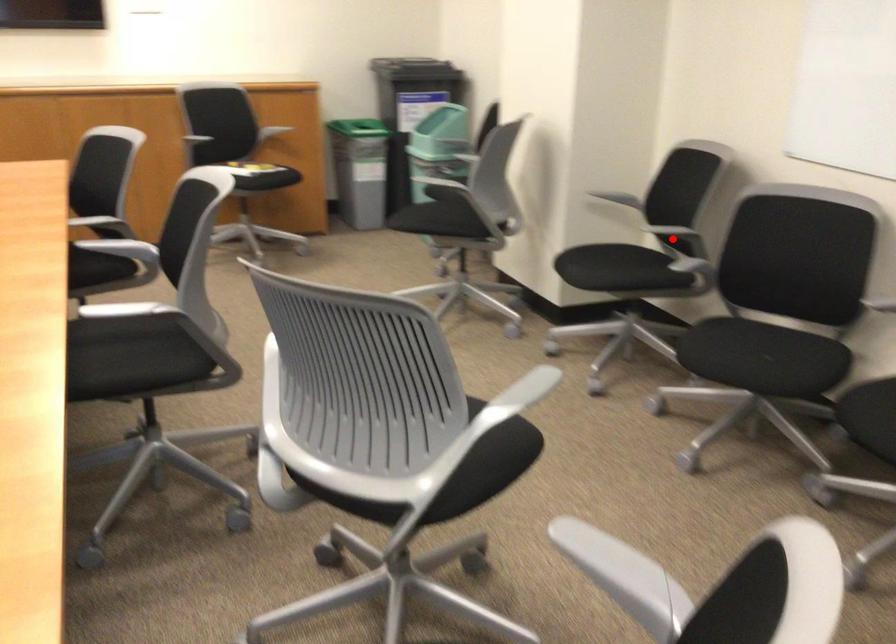
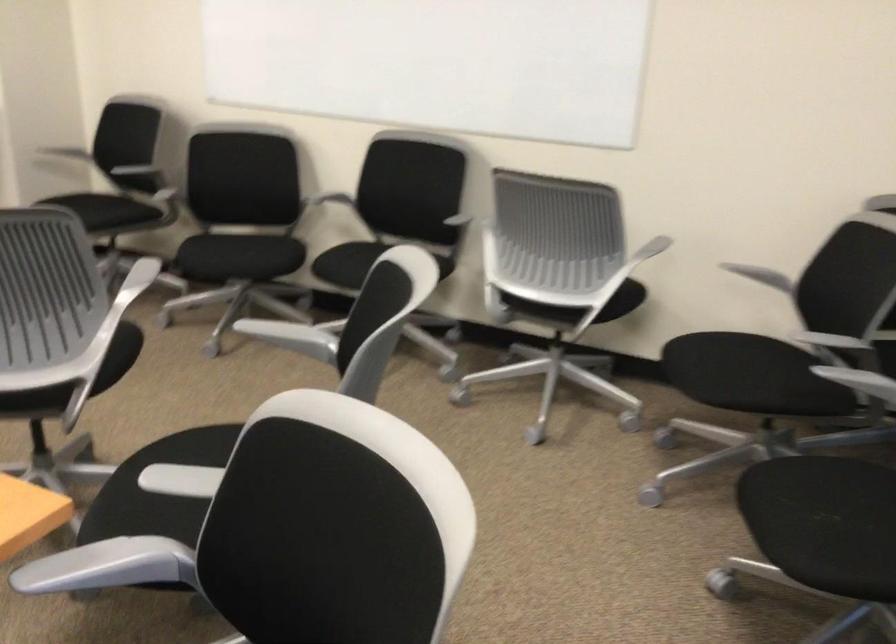
Find the pixel in the second image that matches the highlighted location in the first image.

(152, 180)